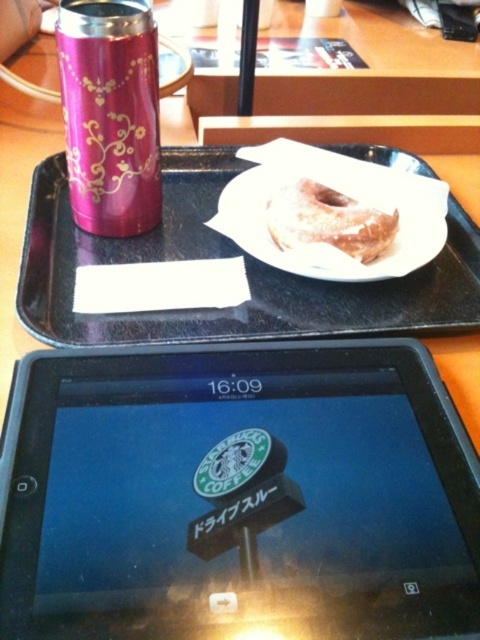
Is black plastic tray at upper center positioned at the back of white paper plate at center?

No, black plastic tray at upper center is closer to the viewer.

Who is positioned more to the left, black plastic tray at upper center or white paper plate at center?

black plastic tray at upper center

At what (x,y) coordinates should I click in order to perform the action: click on black plastic tray at upper center. Please return your answer as a coordinate pair (x, y). This screenshot has width=480, height=640. Looking at the image, I should click on (227, 257).

Image resolution: width=480 pixels, height=640 pixels. In order to click on black plastic tray at upper center in this screenshot , I will do `click(227, 257)`.

Is point (92, 124) closer to viewer compared to point (365, 212)?

Yes, it is.

Can you confirm if metallic gold-patterned can at upper left is smaller than glazed sugar donut at center?

No, metallic gold-patterned can at upper left is not smaller than glazed sugar donut at center.

At what (x,y) coordinates should I click in order to perform the action: click on metallic gold-patterned can at upper left. Please return your answer as a coordinate pair (x, y). The width and height of the screenshot is (480, 640). Looking at the image, I should click on (110, 113).

Image resolution: width=480 pixels, height=640 pixels. What are the coordinates of `metallic gold-patterned can at upper left` in the screenshot? It's located at (110, 113).

Between metallic gold-patterned can at upper left and white paper plate at center, which one has more height?

metallic gold-patterned can at upper left is taller.

Is metallic gold-patterned can at upper left smaller than white paper plate at center?

Yes, metallic gold-patterned can at upper left is smaller than white paper plate at center.

Locate an element on the screen. Image resolution: width=480 pixels, height=640 pixels. metallic gold-patterned can at upper left is located at coordinates (110, 113).